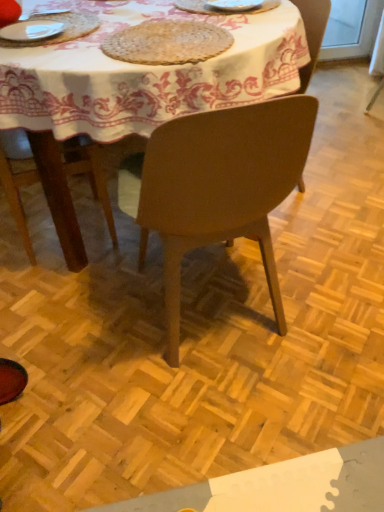
Question: Is woven natural fiber mat at upper center smaller than white ceramic plate at upper center?

Choices:
 (A) no
 (B) yes

Answer: (A)

Question: From a real-world perspective, is woven natural fiber mat at upper center located beneath white ceramic plate at upper center?

Choices:
 (A) yes
 (B) no

Answer: (A)

Question: From the image's perspective, does woven natural fiber mat at upper center appear lower than white ceramic plate at upper center?

Choices:
 (A) yes
 (B) no

Answer: (A)

Question: From the image's perspective, is woven natural fiber mat at upper center above white ceramic plate at upper center?

Choices:
 (A) yes
 (B) no

Answer: (B)

Question: Is woven natural fiber mat at upper center in contact with white ceramic plate at upper center?

Choices:
 (A) no
 (B) yes

Answer: (A)

Question: Is woven natural fiber mat at upper center thinner than white ceramic plate at upper center?

Choices:
 (A) no
 (B) yes

Answer: (A)

Question: Considering the relative positions of matte brown chair at center, marked as the first chair in a front-to-back arrangement, and woven natural fiber mat at upper center in the image provided, is matte brown chair at center, marked as the first chair in a front-to-back arrangement, to the right of woven natural fiber mat at upper center from the viewer's perspective?

Choices:
 (A) yes
 (B) no

Answer: (A)

Question: From the image's perspective, does matte brown chair at center, marked as the first chair in a front-to-back arrangement, appear higher than woven natural fiber mat at upper center?

Choices:
 (A) no
 (B) yes

Answer: (A)

Question: Is matte brown chair at center, which ranks as the 2th chair in back-to-front order, closer to the viewer compared to woven natural fiber mat at upper center?

Choices:
 (A) yes
 (B) no

Answer: (A)

Question: Is matte brown chair at center, which ranks as the 2th chair in back-to-front order, located outside woven natural fiber mat at upper center?

Choices:
 (A) no
 (B) yes

Answer: (B)

Question: Is matte brown chair at center, marked as the first chair in a front-to-back arrangement, turned away from woven natural fiber mat at upper center?

Choices:
 (A) no
 (B) yes

Answer: (A)

Question: Would you say woven natural fiber mat at upper center is part of matte brown chair at center, marked as the first chair in a front-to-back arrangement,'s contents?

Choices:
 (A) yes
 (B) no

Answer: (A)

Question: Is the depth of white fabric tablecloth at center greater than that of woven natural fiber mat at upper center?

Choices:
 (A) yes
 (B) no

Answer: (B)